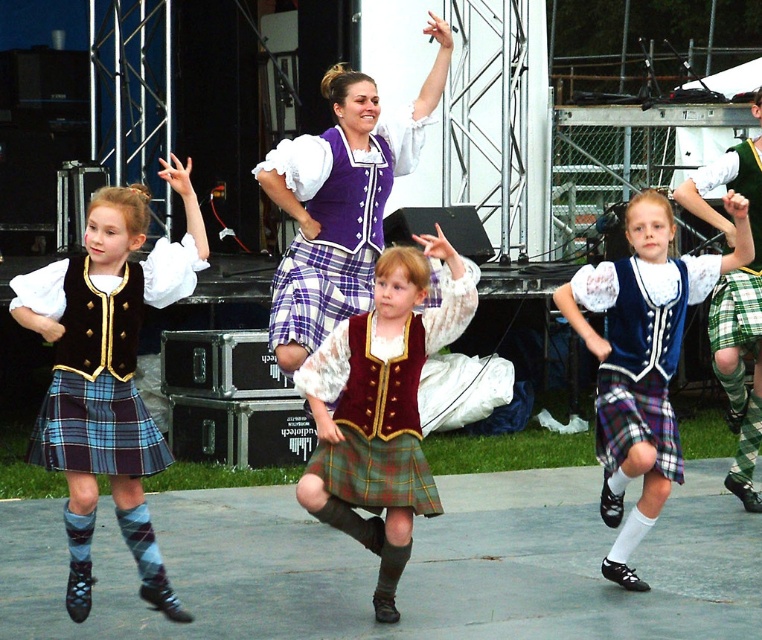
The image size is (762, 640). What do you see at coordinates (381, 408) in the screenshot?
I see `velvet maroon vest at center` at bounding box center [381, 408].

Between velvet maroon vest at center and purple satin dress at center, which one appears on the right side from the viewer's perspective?

velvet maroon vest at center

Between point (325, 380) and point (396, 163), which one is positioned behind?

The point (396, 163) is behind.

At what (x,y) coordinates should I click in order to perform the action: click on velvet maroon vest at center. Please return your answer as a coordinate pair (x, y). Image resolution: width=762 pixels, height=640 pixels. Looking at the image, I should click on (381, 408).

Who is taller, purple satin dress at center or green plaid kilt at right?

Standing taller between the two is green plaid kilt at right.

Can you confirm if purple satin dress at center is wider than green plaid kilt at right?

Yes, purple satin dress at center is wider than green plaid kilt at right.

Locate an element on the screen. Image resolution: width=762 pixels, height=640 pixels. purple satin dress at center is located at coordinates (341, 202).

What are the coordinates of `purple satin dress at center` in the screenshot? It's located at click(341, 202).

Measure the distance between point (123,224) and camera.

They are 25.87 feet apart.

Is plaid wool kilt at center shorter than green plaid kilt at right?

Yes, plaid wool kilt at center is shorter than green plaid kilt at right.

Describe the element at coordinates (107, 372) in the screenshot. I see `plaid wool kilt at center` at that location.

Identify the location of plaid wool kilt at center. (107, 372).